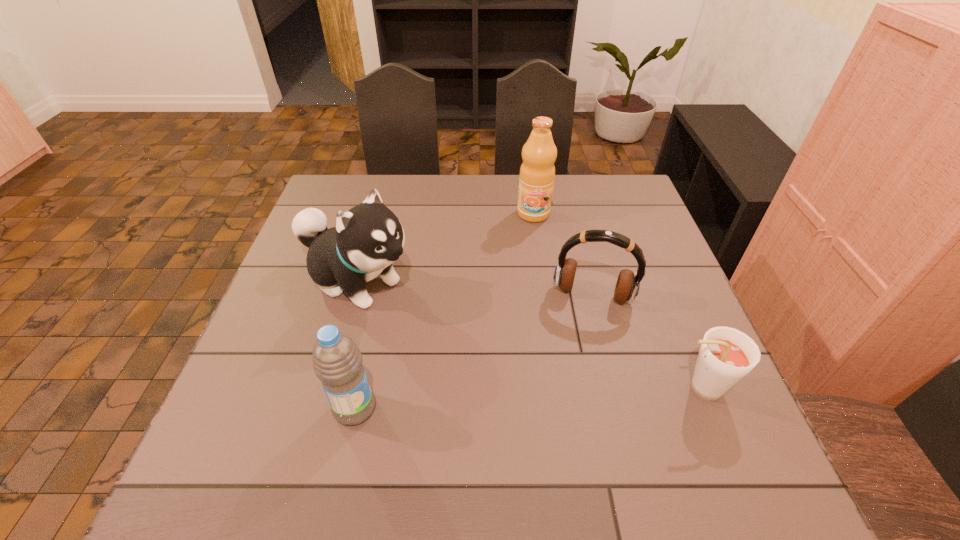
Where is `free space located 0.050m on the ear cup of the headset`? free space located 0.050m on the ear cup of the headset is located at coordinates (581, 326).

Locate an element on the screen. Image resolution: width=960 pixels, height=540 pixels. vacant space located 0.060m on the ear cup of the headset is located at coordinates (581, 329).

Where is `vacant space located on the front label of the farthest object`? The width and height of the screenshot is (960, 540). vacant space located on the front label of the farthest object is located at coordinates (534, 239).

This screenshot has width=960, height=540. In order to click on free space located on the front label of the farthest object in this screenshot , I will do `click(536, 298)`.

Locate an element on the screen. The height and width of the screenshot is (540, 960). vacant point located 0.070m on the front label of the farthest object is located at coordinates (534, 239).

The image size is (960, 540). In order to click on vacant space positioned at the face of the puppy in this screenshot , I will do `click(525, 372)`.

You are a GUI agent. You are given a task and a screenshot of the screen. Output one action in this format:
    pyautogui.click(x=<x>, y=<y>)
    Task: Click on the vacant region located at the face of the puppy
    This screenshot has width=960, height=540.
    Given the screenshot: What is the action you would take?
    pyautogui.click(x=440, y=323)

Locate an element on the screen. The height and width of the screenshot is (540, 960). blank area located 0.310m at the face of the puppy is located at coordinates (509, 363).

At what (x,y) coordinates should I click in order to perform the action: click on object situated at the far edge. Please return your answer as a coordinate pair (x, y). Looking at the image, I should click on (537, 172).

I want to click on water bottle positioned at the near edge, so click(x=337, y=361).